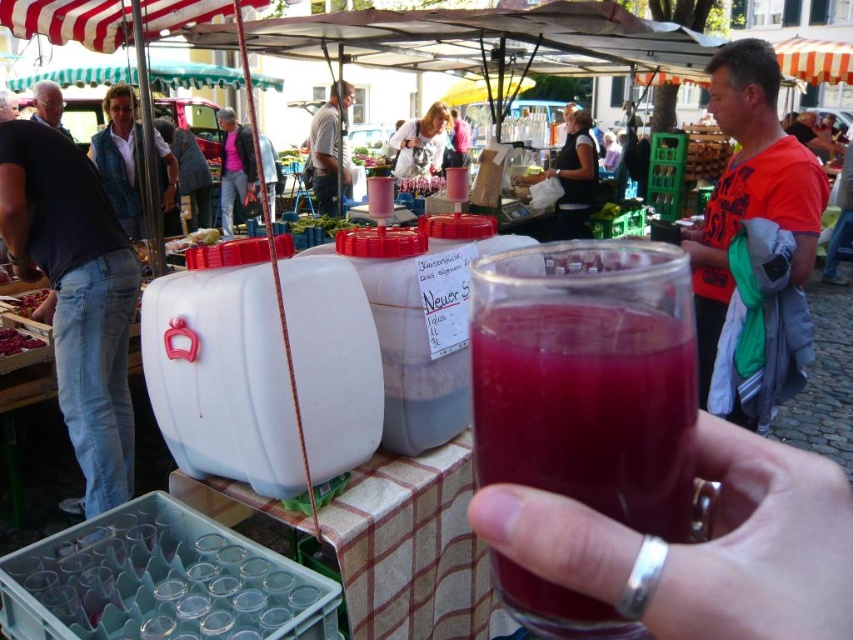
Question: Which object is positioned farthest from the matte black shirt at center?

Choices:
 (A) jeans at left
 (B) light blue denim jacket at upper left
 (C) translucent plastic container at center
 (D) gray hair at upper left

Answer: (A)

Question: Considering the relative positions of light blue denim jacket at upper left and dark gray shirt at center in the image provided, where is light blue denim jacket at upper left located with respect to dark gray shirt at center?

Choices:
 (A) right
 (B) left

Answer: (B)

Question: Among these objects, which one is nearest to the camera?

Choices:
 (A) matte black shirt at center
 (B) jeans at left
 (C) light blue denim jacket at upper left
 (D) translucent glass at center

Answer: (D)

Question: Does matte black shirt at center appear on the left side of ripe red berries at lower left?

Choices:
 (A) no
 (B) yes

Answer: (A)

Question: Which object appears closest to the camera in this image?

Choices:
 (A) matte black shirt at center
 (B) jeans at left

Answer: (B)

Question: Does translucent plastic container at center have a greater width compared to ripe red berries at lower left?

Choices:
 (A) yes
 (B) no

Answer: (A)